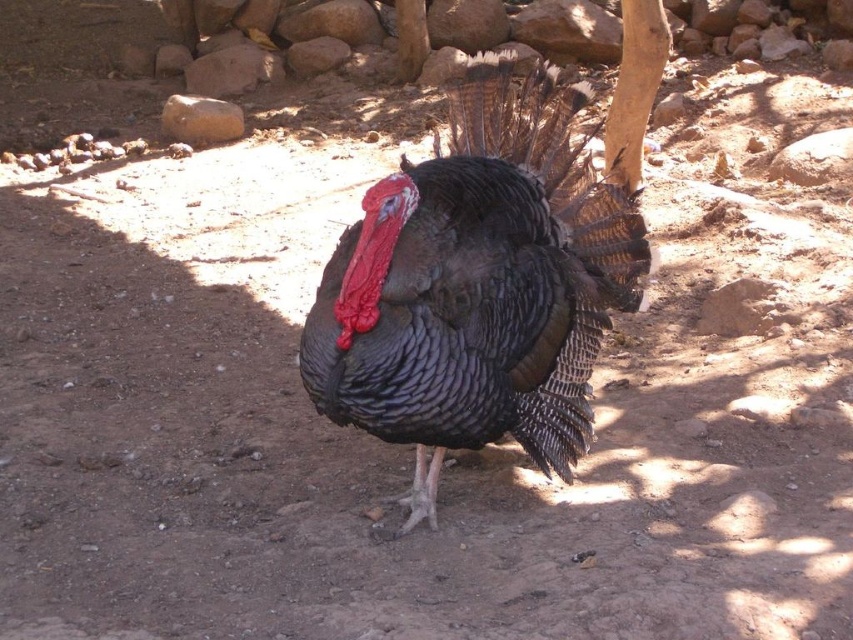
Question: Among these objects, which one is nearest to the camera?

Choices:
 (A) smooth brown rock at upper left
 (B) smooth brown rock at upper center
 (C) gray rock at center
 (D) shiny black turkey at center

Answer: (D)

Question: Is shiny black turkey at center thinner than smooth brown rock at upper left?

Choices:
 (A) yes
 (B) no

Answer: (B)

Question: Based on their relative distances, which object is nearer to the shiny black turkey at center?

Choices:
 (A) smooth brown rock at upper left
 (B) gray rock at center

Answer: (A)

Question: Can you confirm if gray rock at center is positioned above smooth brown rock at upper center?

Choices:
 (A) yes
 (B) no

Answer: (B)

Question: Does shiny black turkey at center have a smaller size compared to smooth brown rock at upper center?

Choices:
 (A) no
 (B) yes

Answer: (A)

Question: Which point is closer to the camera?

Choices:
 (A) (331, 339)
 (B) (196, 115)
 (C) (216, 84)
 (D) (325, 52)

Answer: (A)